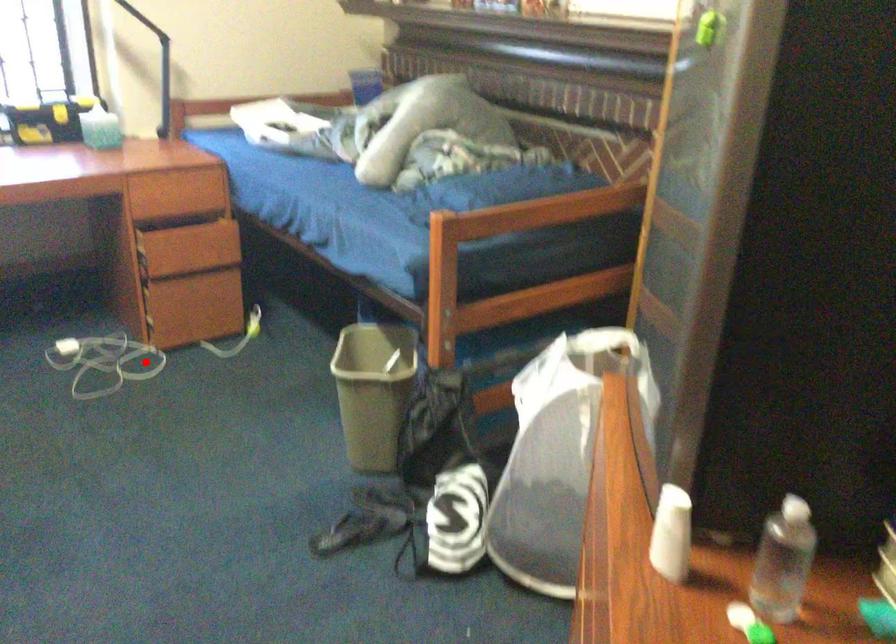
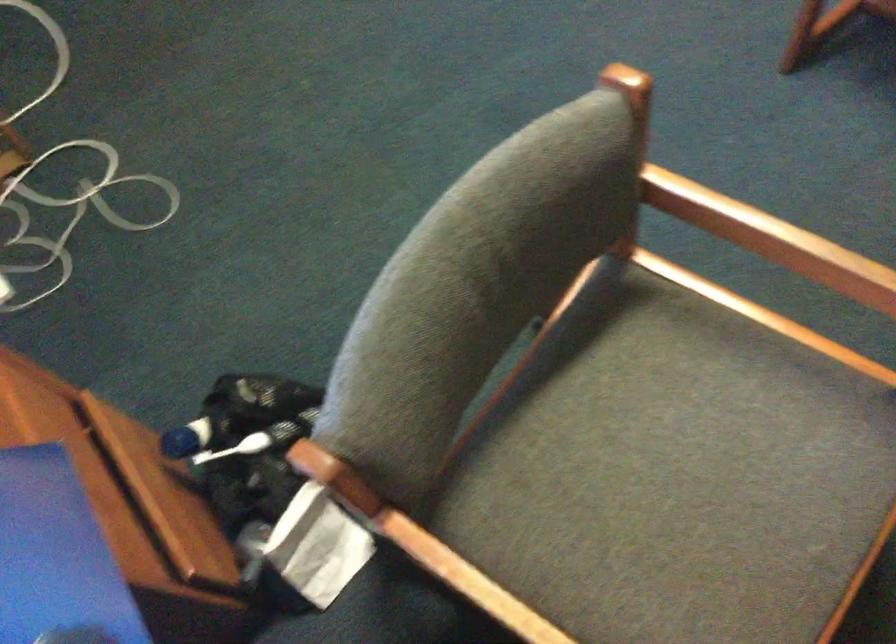
Where in the second image is the point corresponding to the highlighted location from the first image?

(63, 184)